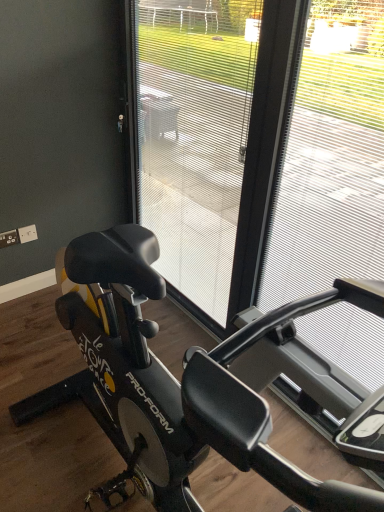
Question: From a real-world perspective, is transparent plastic screen door at center above or below black matte stationary bicycle at center?

Choices:
 (A) below
 (B) above

Answer: (B)

Question: Based on their sizes in the image, would you say transparent plastic screen door at center is bigger or smaller than black matte stationary bicycle at center?

Choices:
 (A) big
 (B) small

Answer: (A)

Question: Considering the real-world distances, which object is closest to the transparent plastic screen door at center?

Choices:
 (A) black matte stationary bicycle at center
 (B) metallic silver frame at right

Answer: (B)

Question: Estimate the real-world distances between objects in this image. Which object is closer to the metallic silver frame at right?

Choices:
 (A) black matte stationary bicycle at center
 (B) transparent plastic screen door at center

Answer: (A)